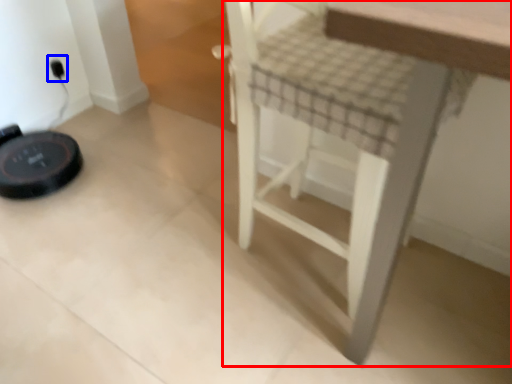
Question: Which object appears farthest to the camera in this image, furniture (highlighted by a red box) or electric outlet (highlighted by a blue box)?

Choices:
 (A) furniture
 (B) electric outlet

Answer: (B)